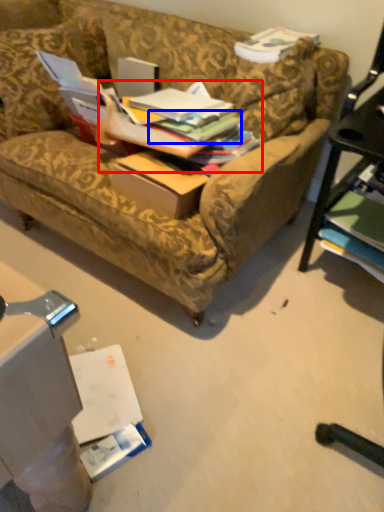
Question: Which of the following is the closest to the observer, book (highlighted by a red box) or book (highlighted by a blue box)?

Choices:
 (A) book
 (B) book

Answer: (A)